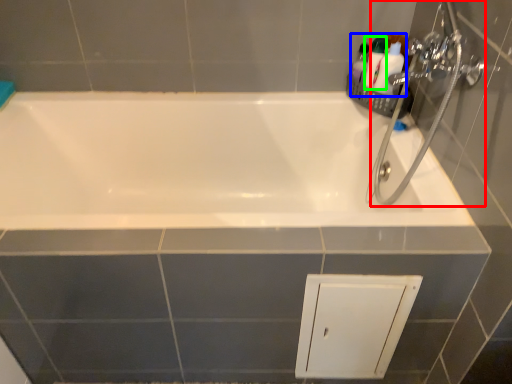
Question: Considering the real-world distances, which object is closest to plumbing fixture (highlighted by a red box)? toiletry (highlighted by a blue box) or toiletry (highlighted by a green box).

Choices:
 (A) toiletry
 (B) toiletry

Answer: (A)